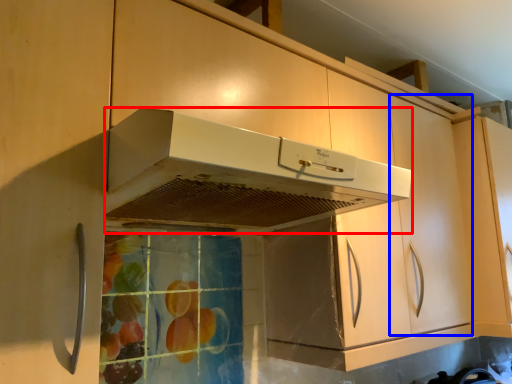
Question: Among these objects, which one is farthest to the camera, home appliance (highlighted by a red box) or cabinetry (highlighted by a blue box)?

Choices:
 (A) home appliance
 (B) cabinetry

Answer: (B)